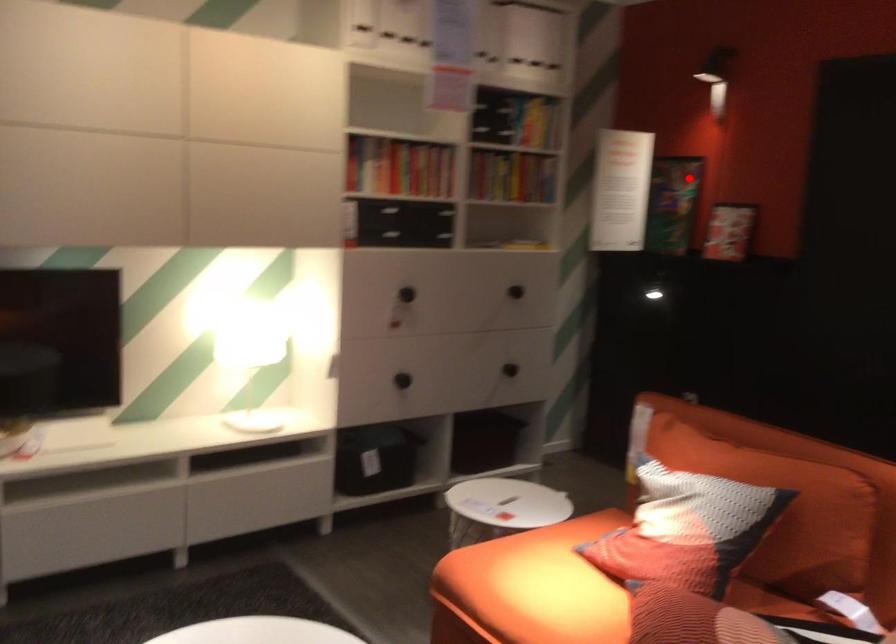
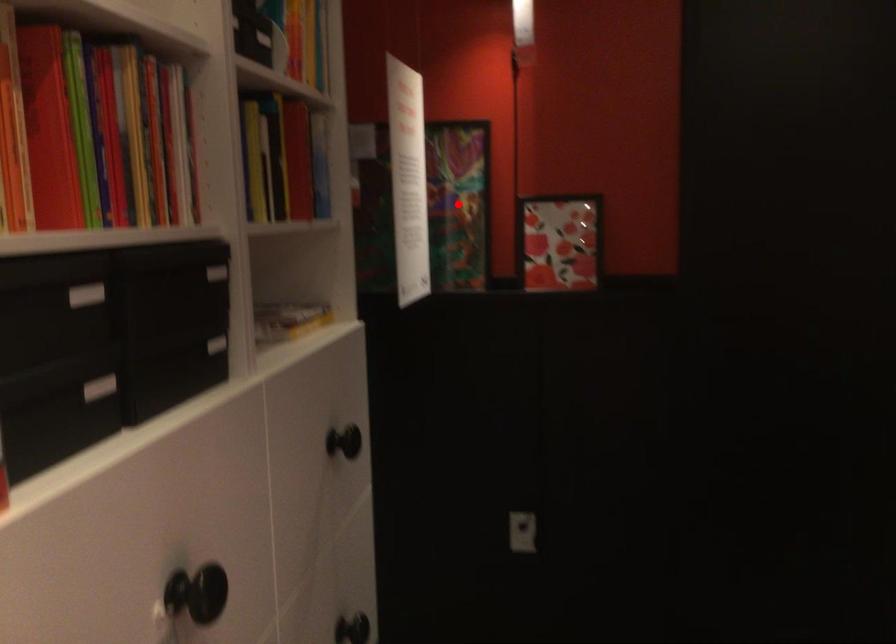
I am providing you with two images of the same scene from different viewpoints. A red point is marked on the first image and another point is marked on the second image. Is the red point in image1 aligned with the point shown in image2?

Yes